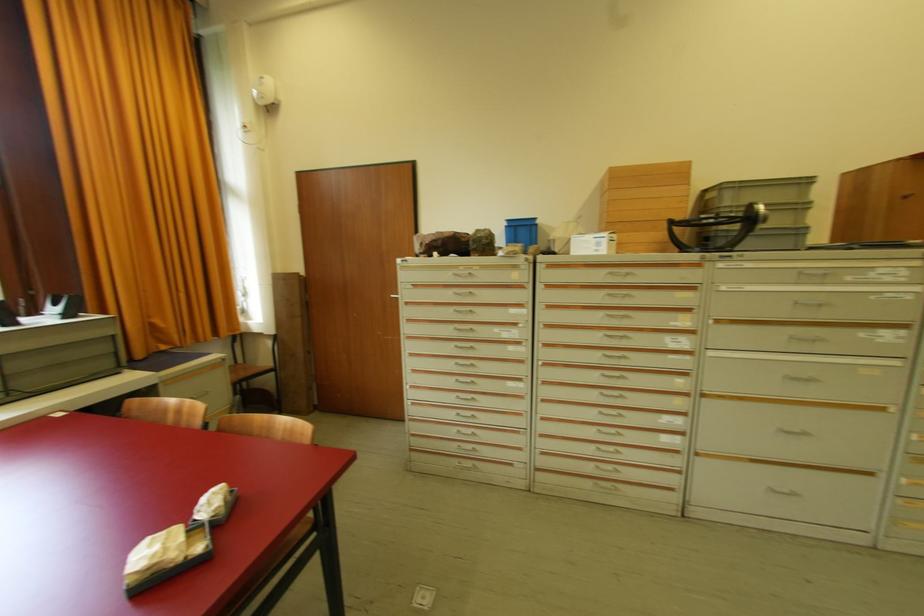
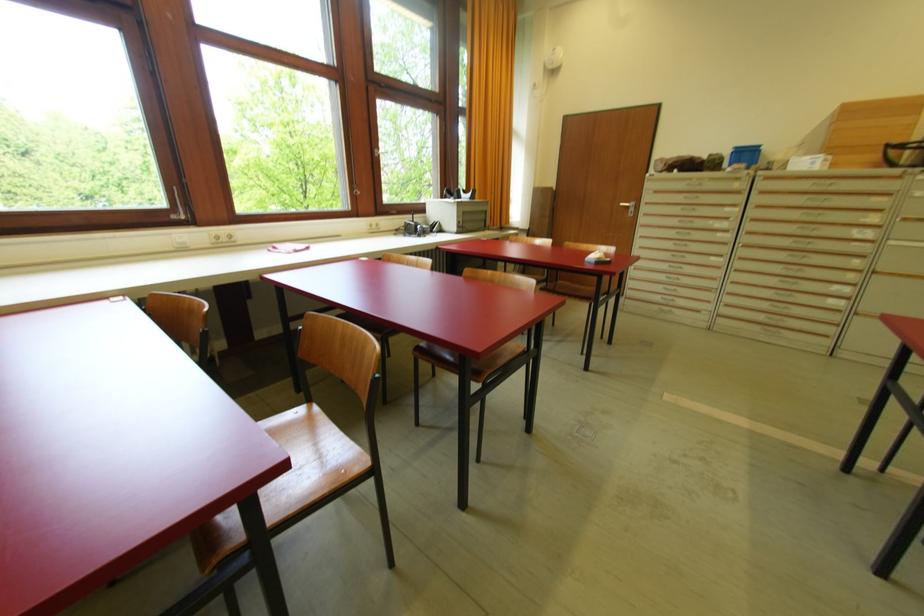
In the second image, find the point that corresponds to (x=616, y=345) in the first image.

(809, 235)